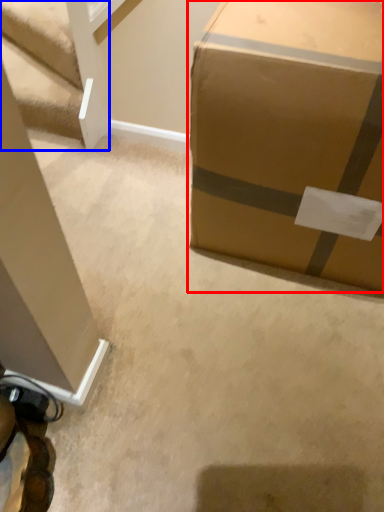
Question: Which point is further to the camera, box (highlighted by a red box) or stairwell (highlighted by a blue box)?

Choices:
 (A) box
 (B) stairwell

Answer: (B)